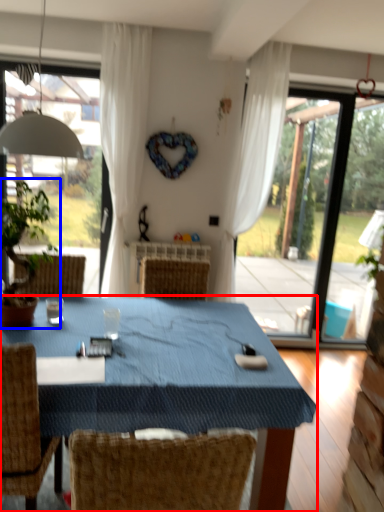
Question: Which object is closer to the camera taking this photo, table (highlighted by a red box) or houseplant (highlighted by a blue box)?

Choices:
 (A) table
 (B) houseplant

Answer: (A)